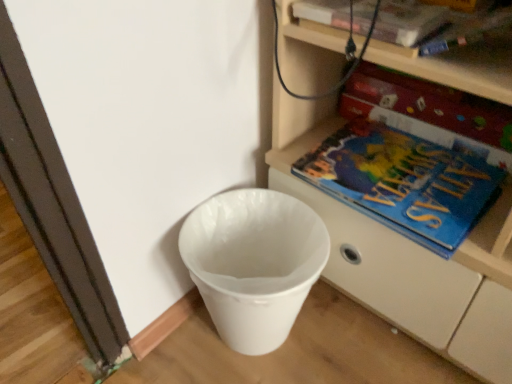
Where is `vacant point above blue matte atlas at lower right (from a real-world perspective)`? The image size is (512, 384). vacant point above blue matte atlas at lower right (from a real-world perspective) is located at coordinates [x=400, y=166].